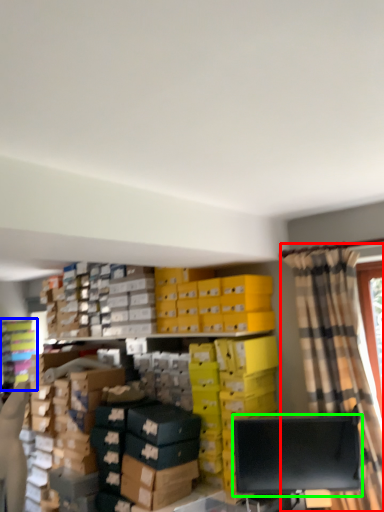
Question: Based on their relative distances, which object is nearer to curtain (highlighted by a red box)? Choose from shelf (highlighted by a blue box) and computer monitor (highlighted by a green box).

Choices:
 (A) shelf
 (B) computer monitor

Answer: (B)